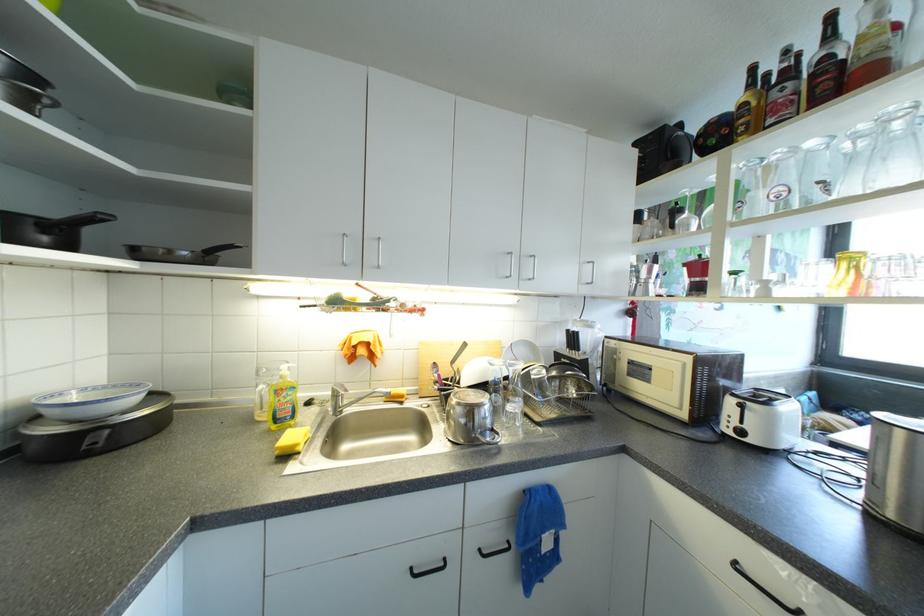
What do you see at coordinates (341, 386) in the screenshot? I see `the faucet handle` at bounding box center [341, 386].